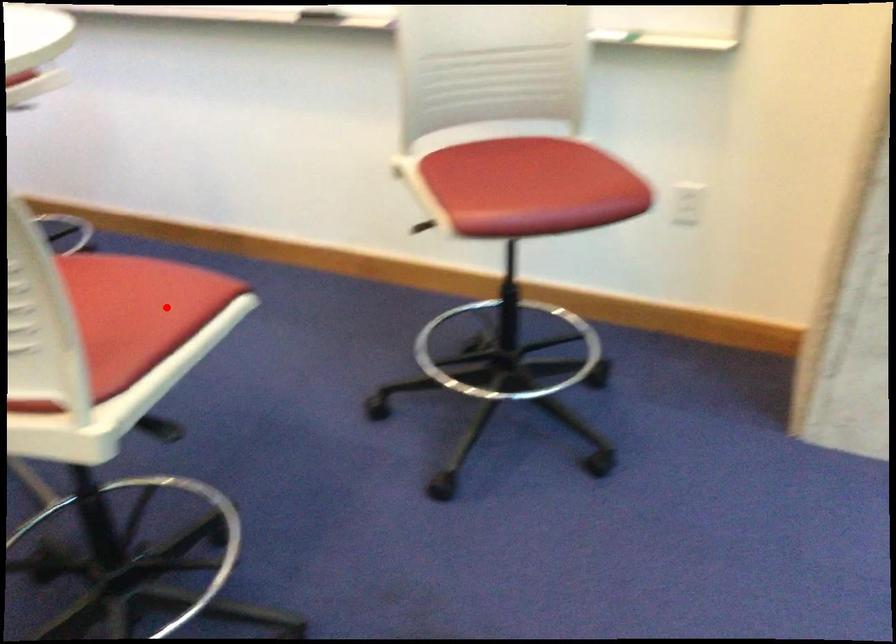
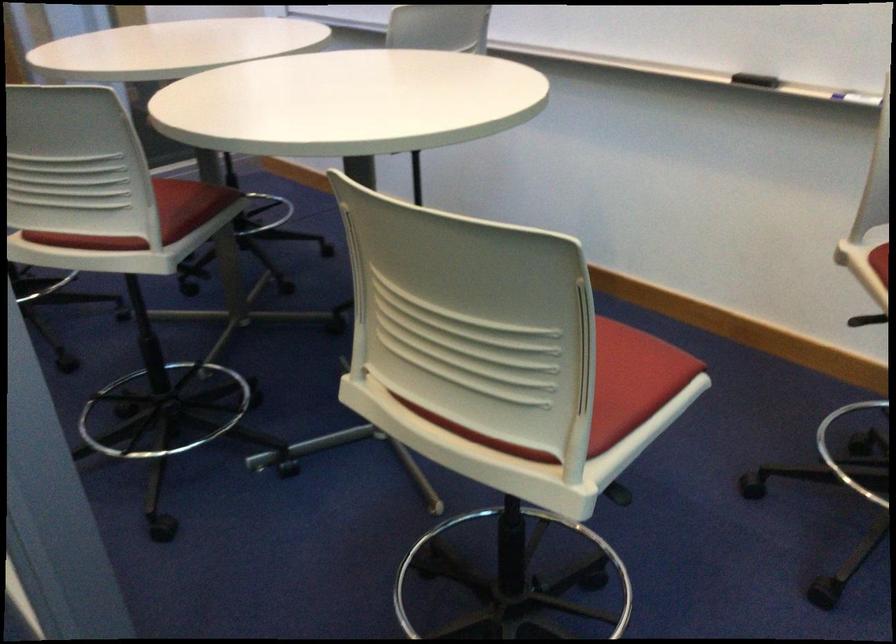
Where in the second image is the point corresponding to the highlighted location from the first image?

(633, 380)